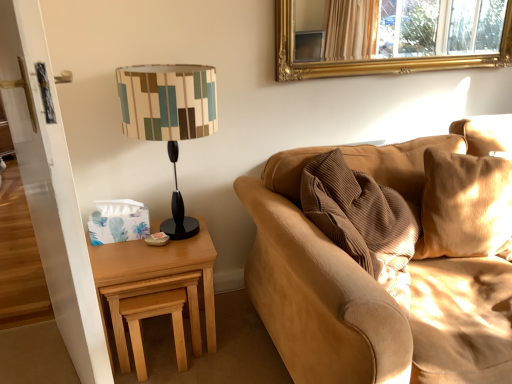
Question: Could you tell me if light brown wood stool at lower left is facing corduroy fabric couch at right?

Choices:
 (A) yes
 (B) no

Answer: (B)

Question: From the image's perspective, is light brown wood stool at lower left beneath corduroy fabric couch at right?

Choices:
 (A) yes
 (B) no

Answer: (A)

Question: Considering the relative sizes of light brown wood stool at lower left and corduroy fabric couch at right in the image provided, is light brown wood stool at lower left wider than corduroy fabric couch at right?

Choices:
 (A) no
 (B) yes

Answer: (A)

Question: Is light brown wood stool at lower left located outside corduroy fabric couch at right?

Choices:
 (A) yes
 (B) no

Answer: (A)

Question: Does light brown wood stool at lower left have a greater height compared to corduroy fabric couch at right?

Choices:
 (A) yes
 (B) no

Answer: (B)

Question: Is there a large distance between light brown wood stool at lower left and corduroy fabric couch at right?

Choices:
 (A) yes
 (B) no

Answer: (B)

Question: From a real-world perspective, is matte black lampshade at left positioned over light brown wood stool at lower left based on gravity?

Choices:
 (A) yes
 (B) no

Answer: (A)

Question: Would you say matte black lampshade at left is outside light brown wood stool at lower left?

Choices:
 (A) yes
 (B) no

Answer: (A)

Question: Is matte black lampshade at left facing towards light brown wood stool at lower left?

Choices:
 (A) no
 (B) yes

Answer: (A)

Question: Does matte black lampshade at left lie behind light brown wood stool at lower left?

Choices:
 (A) yes
 (B) no

Answer: (B)

Question: Is matte black lampshade at left far from light brown wood stool at lower left?

Choices:
 (A) no
 (B) yes

Answer: (A)

Question: Is matte black lampshade at left oriented away from light brown wood stool at lower left?

Choices:
 (A) yes
 (B) no

Answer: (B)

Question: Is light brown wood at left shorter than corduroy fabric couch at right?

Choices:
 (A) no
 (B) yes

Answer: (B)